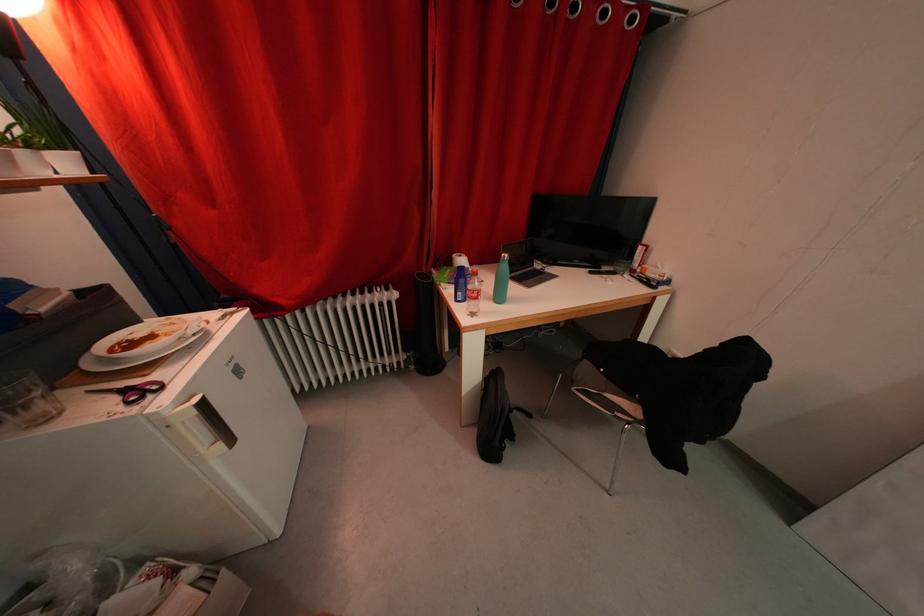
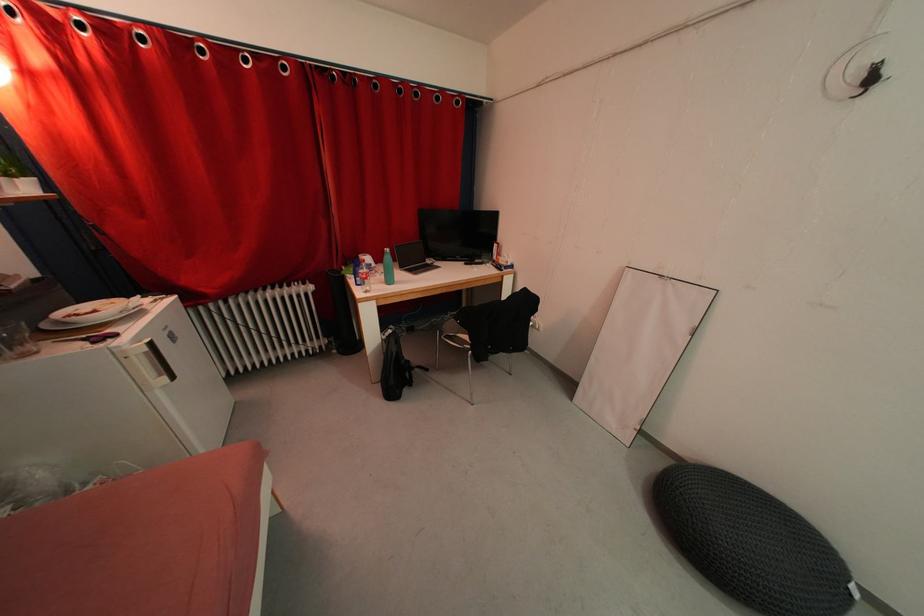
Question: How did the camera likely rotate?

Choices:
 (A) Left
 (B) Right
 (C) Up
 (D) Down

Answer: (B)